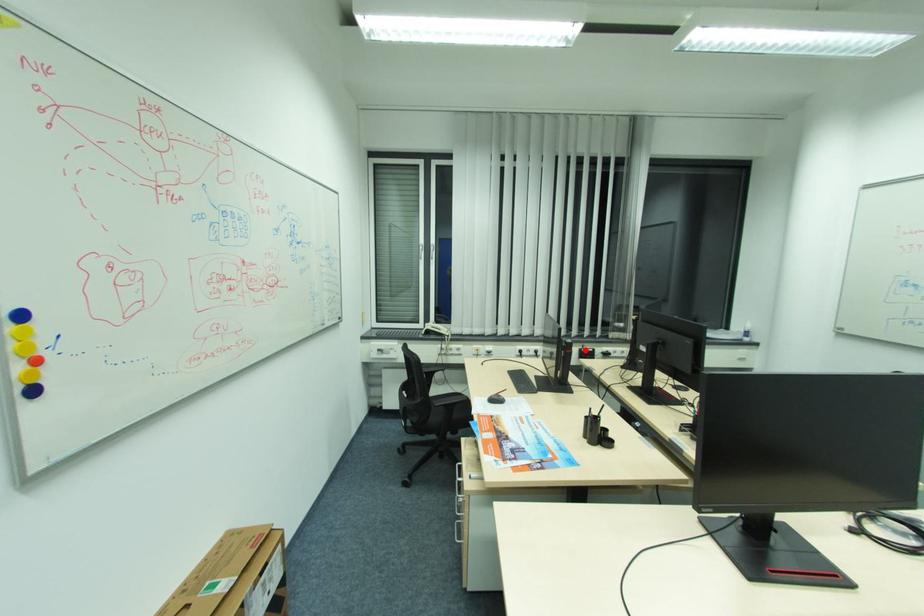
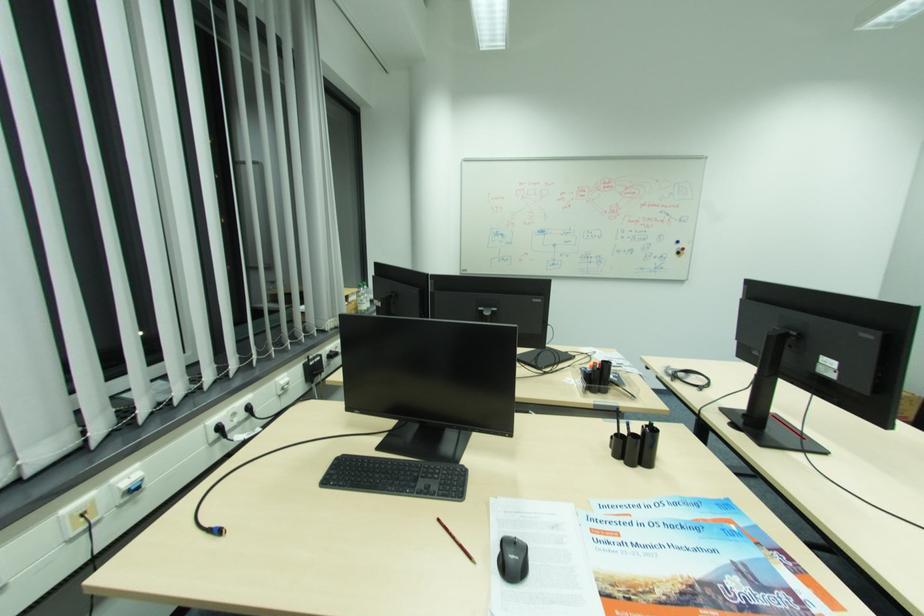
Question: I am providing you with two images of the same scene from different viewpoints. Given a red point in image1, look at the same physical point in image2. Is it:

Choices:
 (A) Closer to the viewpoint
 (B) Farther from the viewpoint

Answer: (A)